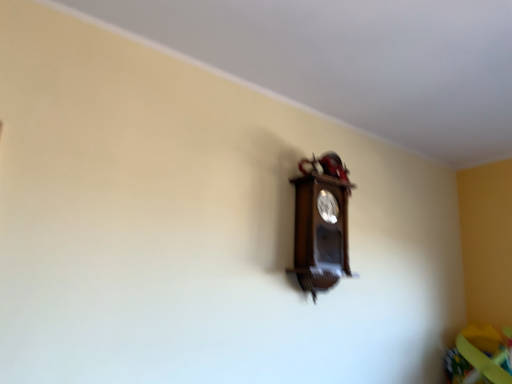
The height and width of the screenshot is (384, 512). What do you see at coordinates (321, 224) in the screenshot? I see `wooden wall clock at center` at bounding box center [321, 224].

Locate an element on the screen. wooden wall clock at center is located at coordinates (321, 224).

The width and height of the screenshot is (512, 384). Find the location of `wooden wall clock at center`. wooden wall clock at center is located at coordinates (321, 224).